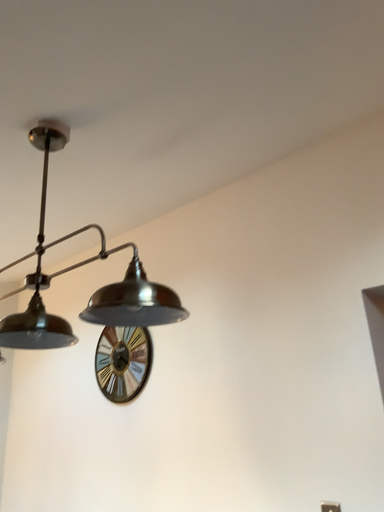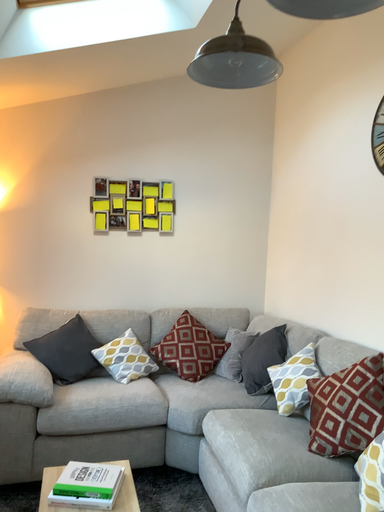
Question: Which way did the camera rotate in the video?

Choices:
 (A) rotated downward
 (B) rotated upward

Answer: (A)